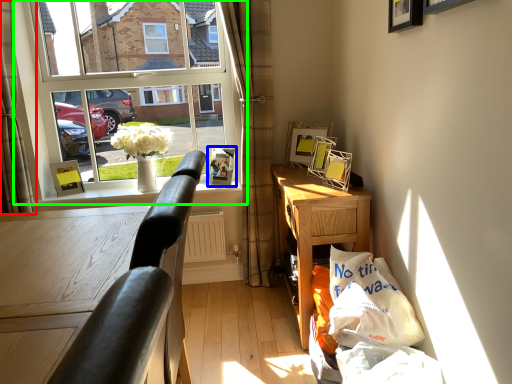
Question: Which object is positioned farthest from curtain (highlighted by a red box)? Select from picture frame (highlighted by a blue box) and window (highlighted by a green box).

Choices:
 (A) picture frame
 (B) window

Answer: (A)